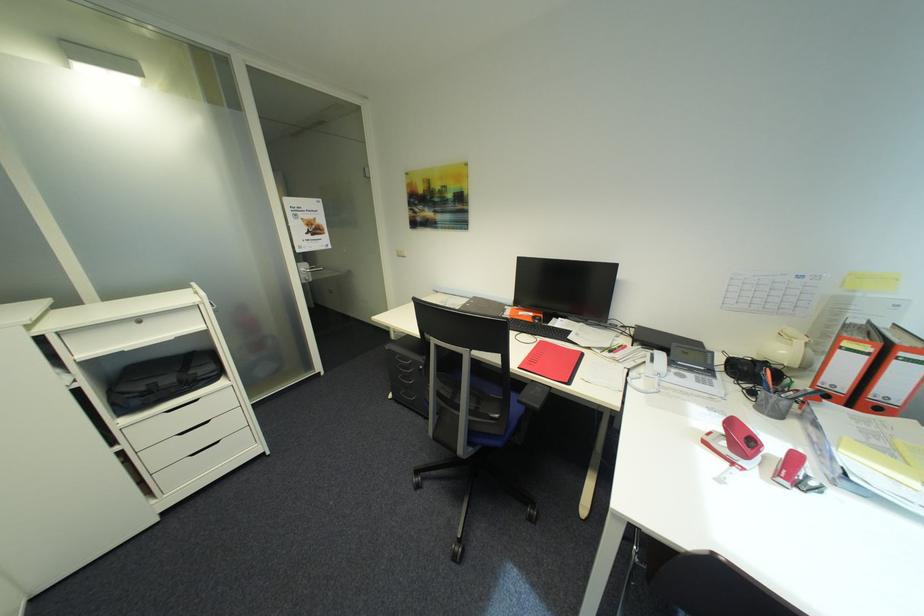
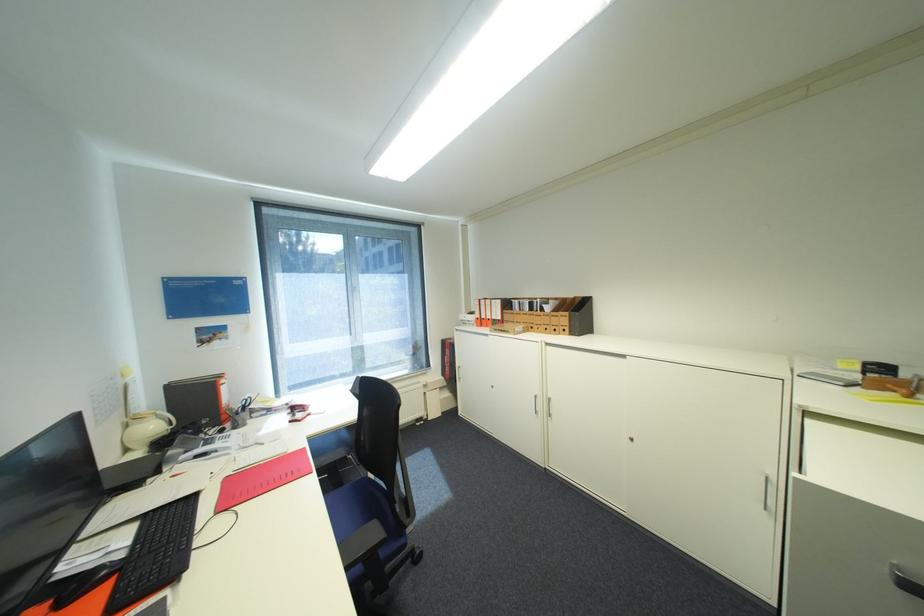
In the second image, find the point that corresponds to the point at 793,353 in the first image.

(161, 427)